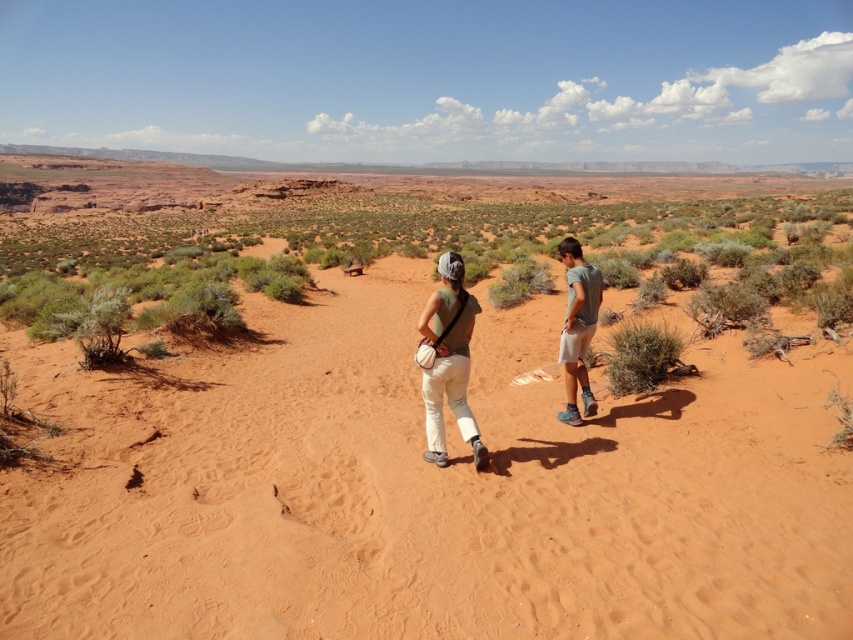
You are planning to take a photo of the desert landscape. You want to ensure that both the white cotton shorts at right and the green shrub at center are clearly visible in the frame. Based on their positions, which object should you focus on first to ensure both are in focus?

You should focus on the green shrub at center first because the white cotton shorts at right is located above it, meaning the shrub is closer to the camera. By focusing on the closer object, both will be in focus.

You are planning to take a photo of the dusty sand at center and the matte green tank top at center in the desert scene. Which object should you focus on first if you want to capture both in a single frame without moving the camera?

The dusty sand at center is positioned on the left side of the matte green tank top at center, so you should focus on the dusty sand at center first to ensure both objects are in frame.

You are a photographer planning to take a photo of the desert scene. You notice the dusty sand at center and the matte green tank top at center. Which object should you focus on first if you want to capture the foreground elements clearly?

The matte green tank top at center should be focused on first because it is closer to the camera than the dusty sand at center, which is above it.